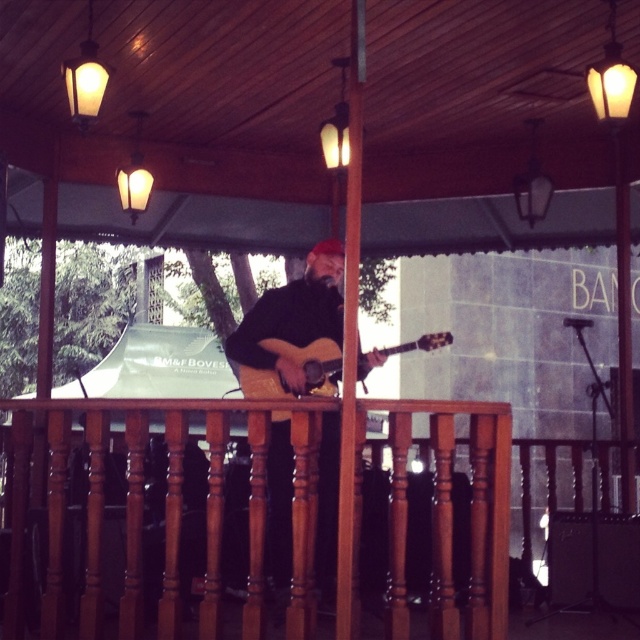
Is brown polished wood railing at center thinner than matte brown guitar at center?

No, brown polished wood railing at center is not thinner than matte brown guitar at center.

Between brown polished wood railing at center and matte brown guitar at center, which one appears on the left side from the viewer's perspective?

brown polished wood railing at center is more to the left.

Is point (308, 438) in front of point (320, 481)?

Yes, point (308, 438) is in front of point (320, 481).

This screenshot has height=640, width=640. I want to click on brown polished wood railing at center, so [168, 506].

Does brown polished wood railing at center have a lesser height compared to acoustic wood guitar at center?

Incorrect, brown polished wood railing at center's height does not fall short of acoustic wood guitar at center's.

Which is behind, point (490, 554) or point (330, 355)?

The point (330, 355) is behind.

Where is `brown polished wood railing at center`? brown polished wood railing at center is located at coordinates (168, 506).

Is the position of matte brown guitar at center less distant than that of acoustic wood guitar at center?

No, it is behind acoustic wood guitar at center.

Is matte brown guitar at center wider than acoustic wood guitar at center?

No.

What do you see at coordinates (292, 316) in the screenshot? The height and width of the screenshot is (640, 640). I see `matte brown guitar at center` at bounding box center [292, 316].

Image resolution: width=640 pixels, height=640 pixels. What are the coordinates of `matte brown guitar at center` in the screenshot? It's located at (292, 316).